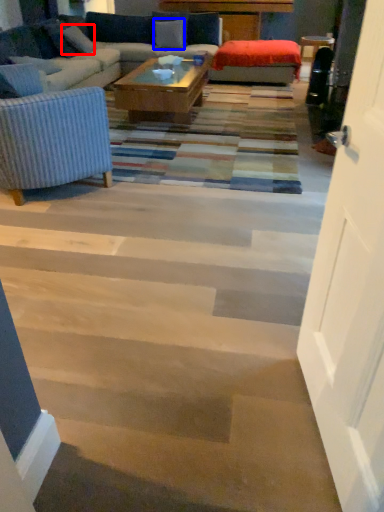
Question: Which object is further to the camera taking this photo, pillow (highlighted by a red box) or pillow (highlighted by a blue box)?

Choices:
 (A) pillow
 (B) pillow

Answer: (B)